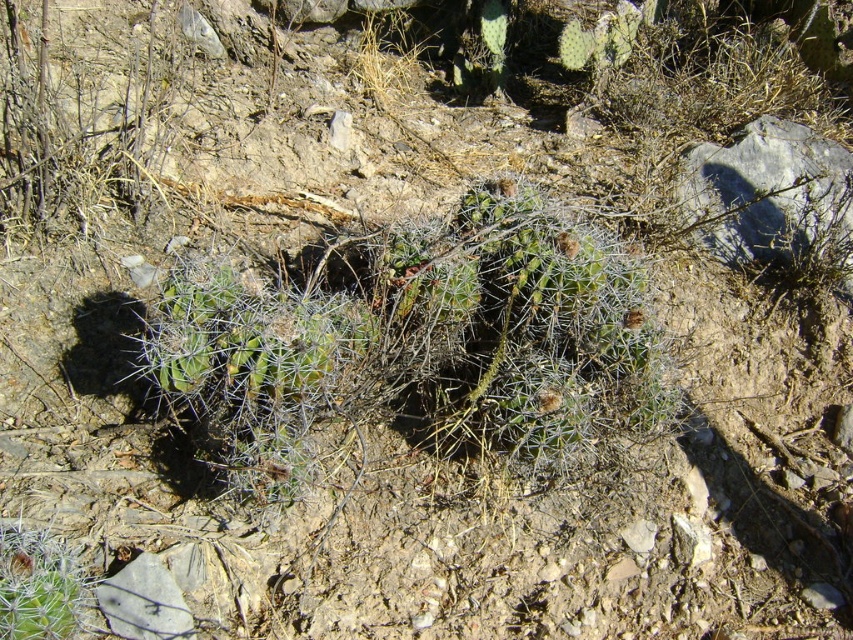
Between spiky green cactus at center and green spiny cactus at center, which one appears on the left side from the viewer's perspective?

From the viewer's perspective, green spiny cactus at center appears more on the left side.

Is point (314, 321) positioned in front of point (25, 593)?

No, it is behind (25, 593).

Image resolution: width=853 pixels, height=640 pixels. I want to click on spiky green cactus at center, so click(250, 368).